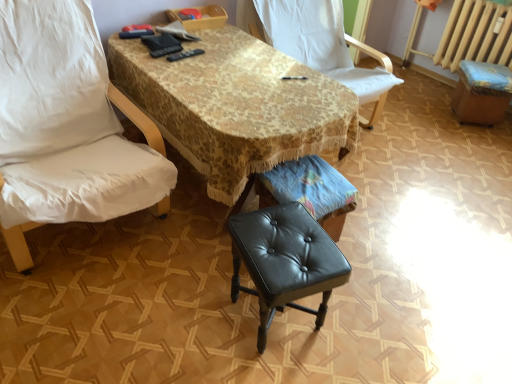
The height and width of the screenshot is (384, 512). Identify the location of free space above black leather stool at center (from a real-world perspective). (290, 241).